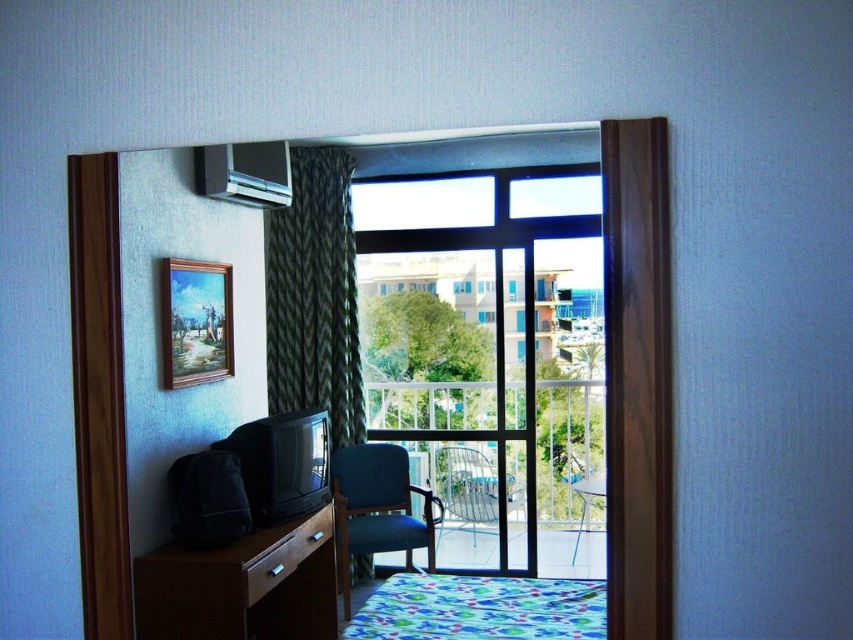
You are a guest in this room and want to place a large rectangular box on the floor between the green zigzag fabric curtain at center and the metallic silver table at center. Based on their widths, can you determine if there will be enough space for the box?

The green zigzag fabric curtain at center might be wider than metallic silver table at center, so there may not be enough space for the box unless the box is smaller than the available gap between them.

You are standing at the camera position in the hotel room and want to place a 2.5 meter long object on the floor between you and the metallic silver table at center. Is there enough space?

The metallic silver table at center is 4.33 meters away from camera, so yes, there is enough space to place a 2.5 meter long object between you and the metallic silver table at center since the distance is greater than the object length.

You are a delivery person who needs to place a large package on the widest surface in the room. According to the image, which object should you choose between the metallic silver table at center and the transparent glass window at center?

The metallic silver table at center is wider than the transparent glass window at center, so you should place the large package on the metallic silver table at center.